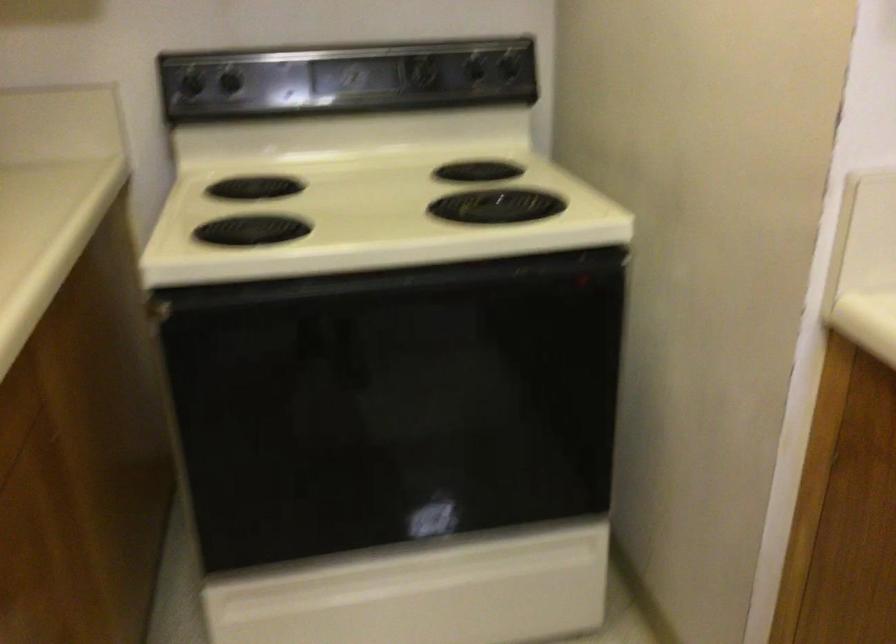
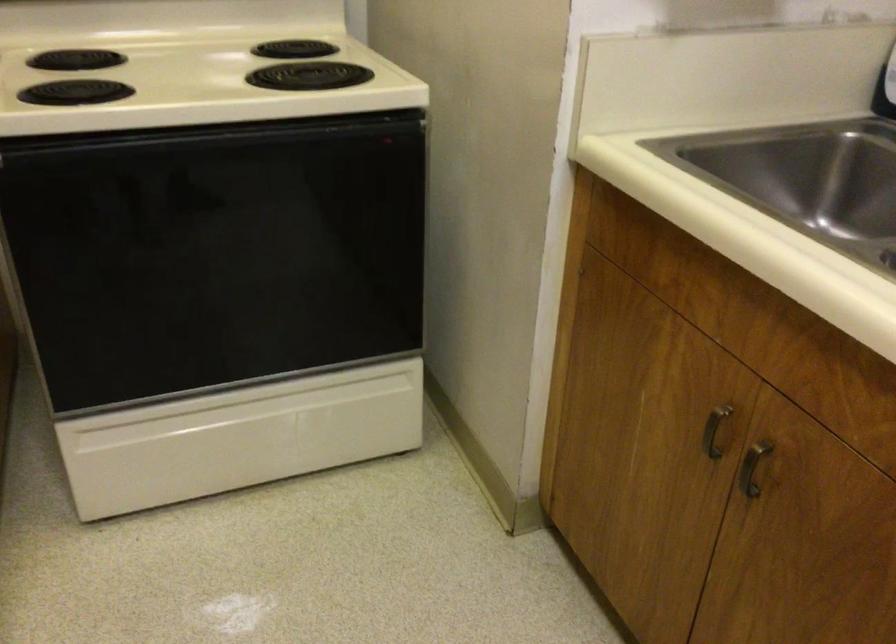
In the second image, find the point that corresponds to point (409, 574) in the first image.

(250, 410)